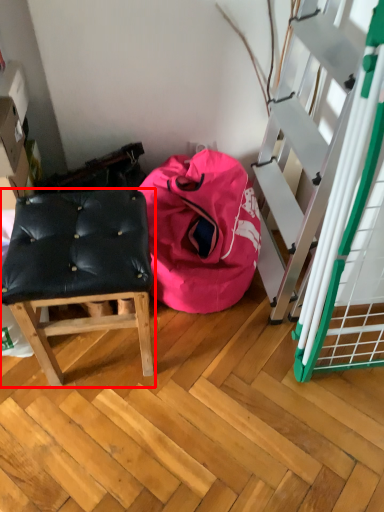
Question: From the image's perspective, considering the relative positions of furniture (annotated by the red box) and bean bag chair in the image provided, where is furniture (annotated by the red box) located with respect to the staircase?

Choices:
 (A) below
 (B) above

Answer: (A)